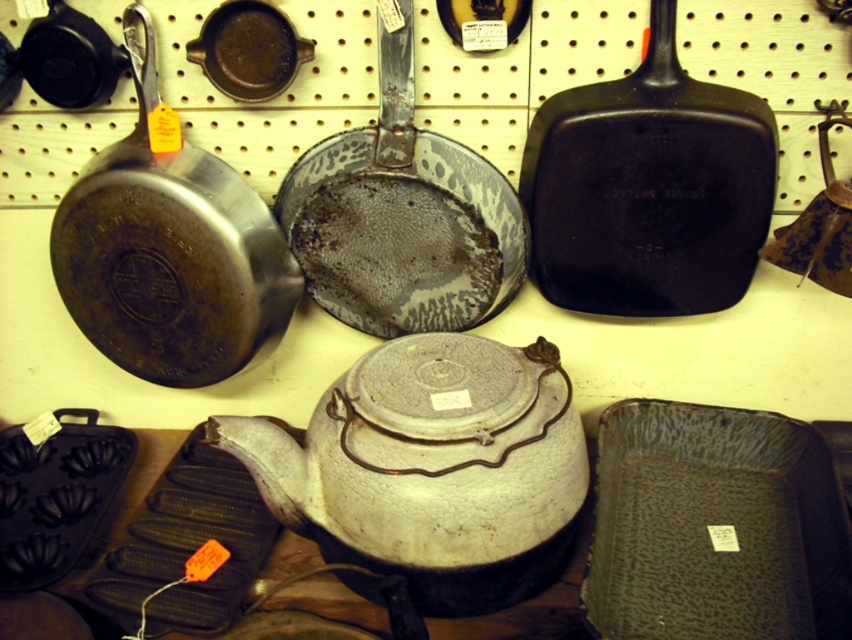
Question: Among these objects, which one is farthest from the camera?

Choices:
 (A) speckled enamel frying pan at center
 (B) matte black frying pan at upper right
 (C) white matte teapot at center

Answer: (A)

Question: Observing the image, what is the correct spatial positioning of matte black frying pan at left in reference to matte cast iron skillet at upper center?

Choices:
 (A) above
 (B) below

Answer: (B)

Question: Which object appears farthest from the camera in this image?

Choices:
 (A) matte cast iron skillet at upper center
 (B) matte black frying pan at upper right

Answer: (A)

Question: In this image, where is white matte teapot at center located relative to matte black frying pan at left?

Choices:
 (A) above
 (B) below

Answer: (B)

Question: Which of the following is the farthest from the observer?

Choices:
 (A) matte cast iron skillet at upper center
 (B) white matte teapot at center

Answer: (A)

Question: In this image, where is matte black frying pan at left located relative to matte cast iron skillet at upper center?

Choices:
 (A) above
 (B) below

Answer: (B)